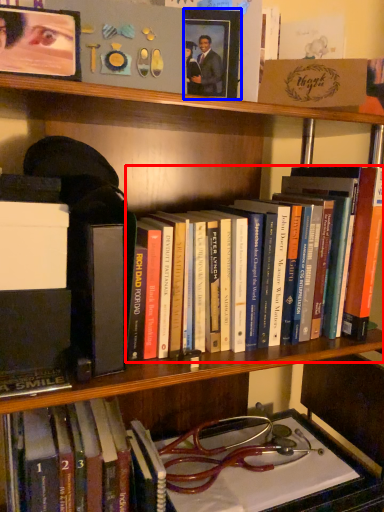
Question: Which object is closer to the camera taking this photo, book (highlighted by a red box) or picture frame (highlighted by a blue box)?

Choices:
 (A) book
 (B) picture frame

Answer: (A)